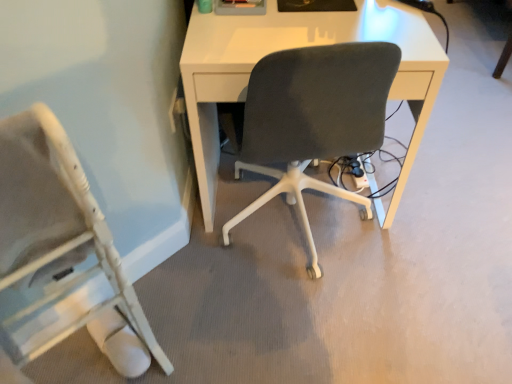
What do you see at coordinates (61, 241) in the screenshot?
I see `white wood chair at lower left` at bounding box center [61, 241].

The height and width of the screenshot is (384, 512). I want to click on white wood chair at lower left, so pyautogui.click(x=61, y=241).

I want to click on white matte desk at center, so click(298, 47).

What do you see at coordinates (298, 47) in the screenshot?
I see `white matte desk at center` at bounding box center [298, 47].

Measure the distance between white matte desk at center and camera.

The depth of white matte desk at center is 1.11 meters.

Identify the location of white wood chair at lower left. This screenshot has height=384, width=512. (61, 241).

Which is more to the left, white matte desk at center or white wood chair at lower left?

From the viewer's perspective, white wood chair at lower left appears more on the left side.

Is white matte desk at center further to camera compared to white wood chair at lower left?

Yes, white matte desk at center is behind white wood chair at lower left.

Does point (284, 26) appear closer or farther from the camera than point (2, 227)?

Point (284, 26) is positioned farther from the camera compared to point (2, 227).

From the image's perspective, between white matte desk at center and white wood chair at lower left, which one is located above?

white matte desk at center is shown above in the image.

From a real-world perspective, between white matte desk at center and white wood chair at lower left, who is vertically lower?

white matte desk at center, from a real-world perspective.

Based on the photo, in terms of width, does white matte desk at center look wider or thinner when compared to white wood chair at lower left?

In the image, white matte desk at center appears to be wider than white wood chair at lower left.

Between white matte desk at center and white wood chair at lower left, which one has less height?

white matte desk at center is shorter.

Is white matte desk at center bigger or smaller than white wood chair at lower left?

white matte desk at center is bigger than white wood chair at lower left.

Choose the correct answer: Is white matte desk at center inside white wood chair at lower left or outside it?

The correct answer is: outside.

Would you consider white matte desk at center to be distant from white wood chair at lower left?

Actually, white matte desk at center and white wood chair at lower left are a little close together.

Is white wood chair at lower left at the back of white matte desk at center?

No, white wood chair at lower left is not at the back of white matte desk at center.

The image size is (512, 384). What are the coordinates of `chair positioned vertically above the white matte desk at center (from a real-world perspective)` in the screenshot? It's located at (61, 241).

Is white wood chair at lower left at the right side of white matte desk at center?

In fact, white wood chair at lower left is to the left of white matte desk at center.

Is the depth of white wood chair at lower left less than that of white matte desk at center?

Yes, it is in front of white matte desk at center.

Which is in front, point (20, 155) or point (193, 38)?

The point (20, 155) is more forward.

From the image's perspective, would you say white wood chair at lower left is shown under white matte desk at center?

Yes, from the image's perspective, white wood chair at lower left is beneath white matte desk at center.

From a real-world perspective, is white wood chair at lower left physically above white matte desk at center?

Yes, from a real-world perspective, white wood chair at lower left is over white matte desk at center

Considering the sizes of white wood chair at lower left and white matte desk at center in the image, is white wood chair at lower left wider or thinner than white matte desk at center?

In the image, white wood chair at lower left appears to be more narrow than white matte desk at center.

From their relative heights in the image, would you say white wood chair at lower left is taller or shorter than white matte desk at center?

Clearly, white wood chair at lower left is taller compared to white matte desk at center.

Who is smaller, white wood chair at lower left or white matte desk at center?

Smaller between the two is white wood chair at lower left.

Is white wood chair at lower left outside of white matte desk at center?

Yes, white wood chair at lower left is located beyond the bounds of white matte desk at center.

Is white wood chair at lower left in contact with white matte desk at center?

white wood chair at lower left is not next to white matte desk at center, and they're not touching.

Is white matte desk at center at the back of white wood chair at lower left?

That's not correct — white wood chair at lower left is not looking away from white matte desk at center.

The width and height of the screenshot is (512, 384). In the image, there is a white wood chair at lower left. What are the coordinates of `desk below it (from a real-world perspective)` in the screenshot? It's located at (298, 47).

The height and width of the screenshot is (384, 512). In order to click on chair located above the white matte desk at center (from a real-world perspective) in this screenshot , I will do `click(61, 241)`.

Identify the location of chair on the left of white matte desk at center. (61, 241).